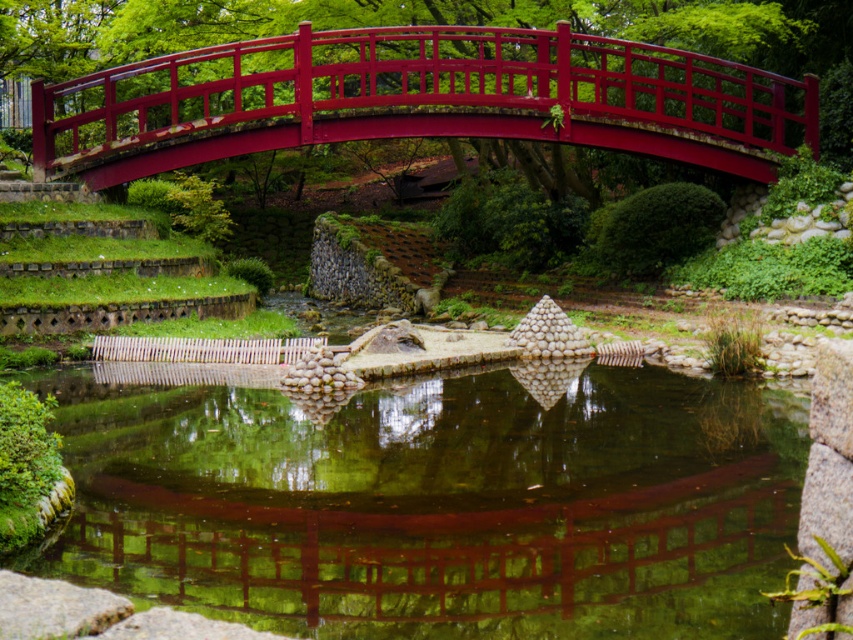
Is green reflective water at center positioned behind glossy wood bridge at upper center?

No, it is not.

Between green reflective water at center and glossy wood bridge at upper center, which one is positioned higher?

Positioned higher is glossy wood bridge at upper center.

Between point (370, 522) and point (726, 122), which one is positioned behind?

Point (726, 122)

You are a GUI agent. You are given a task and a screenshot of the screen. Output one action in this format:
    pyautogui.click(x=<x>, y=<y>)
    Task: Click on the green reflective water at center
    Image resolution: width=853 pixels, height=640 pixels.
    Given the screenshot: What is the action you would take?
    pyautogui.click(x=439, y=502)